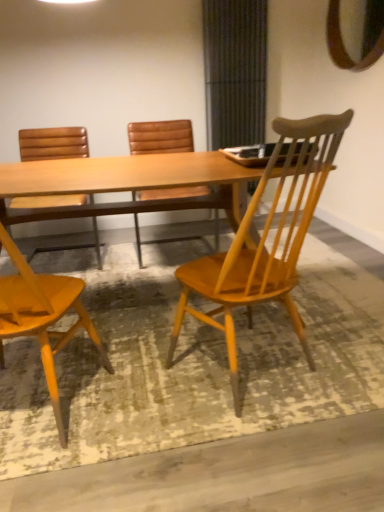
Question: Would you say wooden mirror at upper right is inside or outside light brown wood table at center?

Choices:
 (A) outside
 (B) inside

Answer: (A)

Question: Considering the positions of wooden mirror at upper right and light brown wood table at center in the image, is wooden mirror at upper right wider or thinner than light brown wood table at center?

Choices:
 (A) thin
 (B) wide

Answer: (A)

Question: Estimate the real-world distances between objects in this image. Which object is farther from the wooden chair at center, arranged as the 4th chair when viewed from the left?

Choices:
 (A) wooden mirror at upper right
 (B) light brown wood table at center
 (C) brown leather chair at center, which is the 3th chair in left-to-right order
 (D) matte brown leather chair at left, the 1th chair from the left
 (E) matte wood chair at left, acting as the second chair starting from the left

Answer: (A)

Question: Which of these objects is positioned closest to the wooden mirror at upper right?

Choices:
 (A) wooden chair at center, arranged as the 4th chair when viewed from the left
 (B) matte wood chair at left, the third chair viewed from the right
 (C) light brown wood table at center
 (D) matte brown leather chair at left, the 1th chair from the left
 (E) brown leather chair at center, the second chair in the right-to-left sequence

Answer: (E)